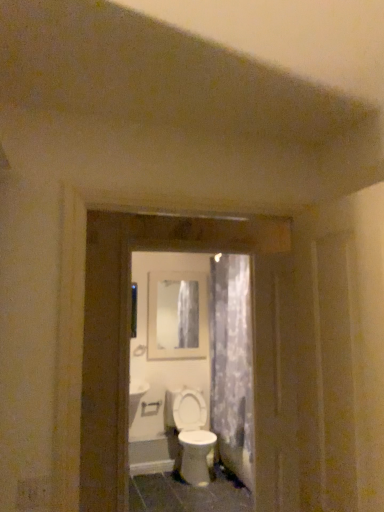
Question: Is translucent floral fabric at center positioned with its back to white glossy screen door at center?

Choices:
 (A) yes
 (B) no

Answer: (B)

Question: Considering the relative positions of translucent floral fabric at center and white glossy screen door at center in the image provided, is translucent floral fabric at center to the left of white glossy screen door at center from the viewer's perspective?

Choices:
 (A) no
 (B) yes

Answer: (A)

Question: Is translucent floral fabric at center smaller than white glossy screen door at center?

Choices:
 (A) no
 (B) yes

Answer: (A)

Question: Considering the relative sizes of translucent floral fabric at center and white glossy screen door at center in the image provided, is translucent floral fabric at center thinner than white glossy screen door at center?

Choices:
 (A) no
 (B) yes

Answer: (A)

Question: Is translucent floral fabric at center positioned behind white glossy screen door at center?

Choices:
 (A) no
 (B) yes

Answer: (B)

Question: Is translucent floral fabric at center next to white glossy screen door at center?

Choices:
 (A) yes
 (B) no

Answer: (B)

Question: Does white glossy screen door at center have a larger size compared to matte glass mirror at center?

Choices:
 (A) no
 (B) yes

Answer: (B)

Question: Considering the relative sizes of white glossy screen door at center and matte glass mirror at center in the image provided, is white glossy screen door at center taller than matte glass mirror at center?

Choices:
 (A) no
 (B) yes

Answer: (B)

Question: From a real-world perspective, is white glossy screen door at center over matte glass mirror at center?

Choices:
 (A) yes
 (B) no

Answer: (B)

Question: Can you confirm if white glossy screen door at center is smaller than matte glass mirror at center?

Choices:
 (A) no
 (B) yes

Answer: (A)

Question: Is white glossy screen door at center located outside matte glass mirror at center?

Choices:
 (A) no
 (B) yes

Answer: (B)

Question: Are white glossy screen door at center and matte glass mirror at center making contact?

Choices:
 (A) yes
 (B) no

Answer: (B)

Question: Does white plastic door handle at center lie behind matte glass mirror at center?

Choices:
 (A) no
 (B) yes

Answer: (A)